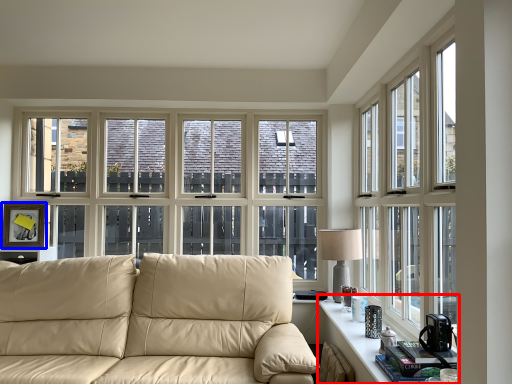
Question: Which point is closer to the camera, table (highlighted by a red box) or picture frame (highlighted by a blue box)?

Choices:
 (A) table
 (B) picture frame

Answer: (A)